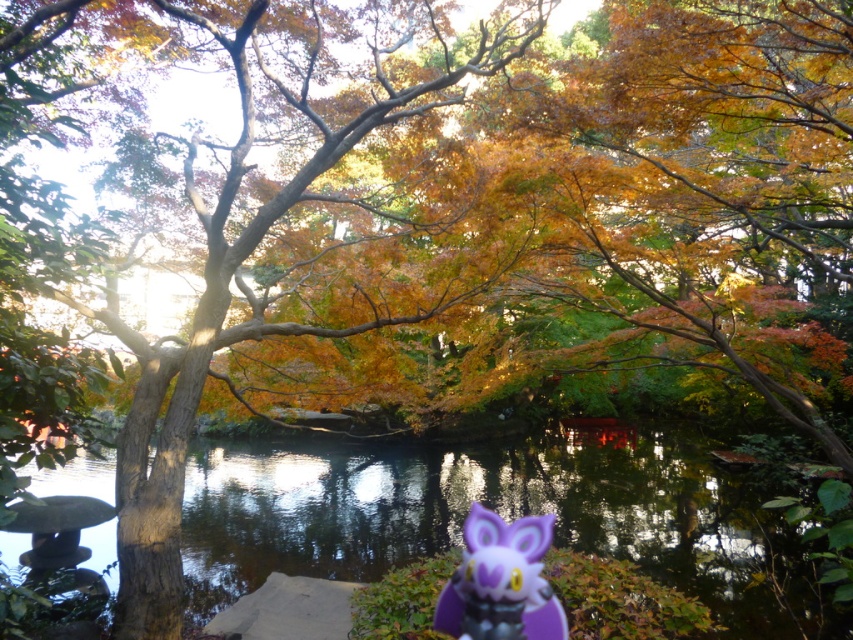
Between transparent water at center and purple matte plush toy at lower center, which one appears on the right side from the viewer's perspective?

transparent water at center is more to the right.

Which is in front, point (97, 525) or point (531, 604)?

Point (531, 604) is in front.

At what (x,y) coordinates should I click in order to perform the action: click on transparent water at center. Please return your answer as a coordinate pair (x, y). Looking at the image, I should click on (486, 506).